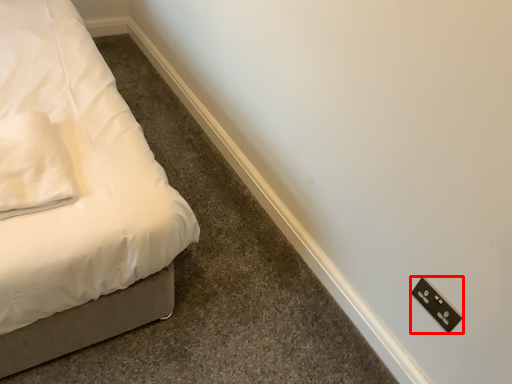
Question: From the image's perspective, what is the correct spatial positioning of light switch (annotated by the red box) in reference to pillow?

Choices:
 (A) below
 (B) above

Answer: (A)